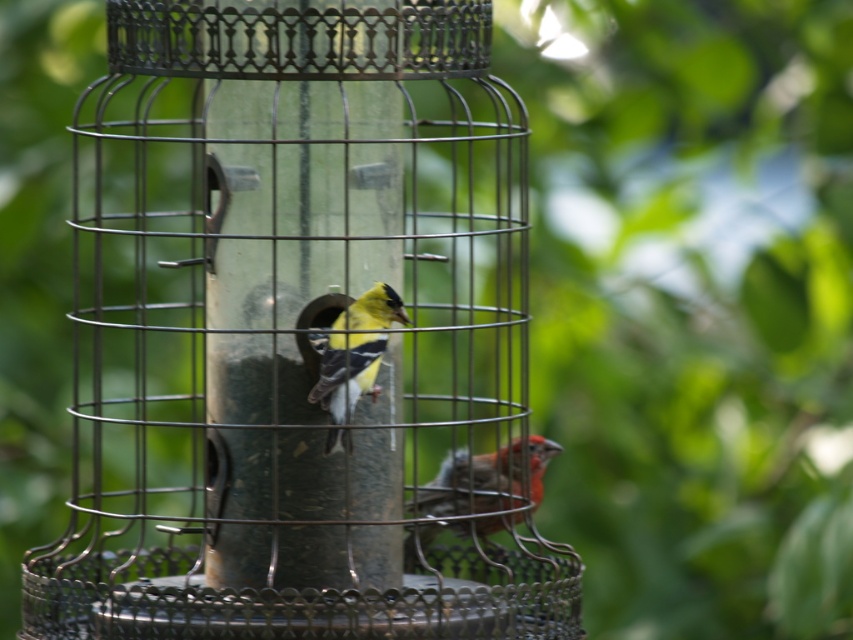
Question: Which of the following is the farthest from the observer?

Choices:
 (A) (381, 339)
 (B) (508, 472)

Answer: (B)

Question: Is metallic wire bird feeder at center thinner than yellow matte bird at center?

Choices:
 (A) yes
 (B) no

Answer: (B)

Question: Which of the following is the farthest from the observer?

Choices:
 (A) coord(349,208)
 (B) coord(496,500)

Answer: (B)

Question: Which of the following is the closest to the observer?

Choices:
 (A) metallic wire bird feeder at center
 (B) yellow matte bird at center

Answer: (A)

Question: Does metallic wire bird feeder at center appear on the right side of matte red bird at lower right?

Choices:
 (A) no
 (B) yes

Answer: (A)

Question: Is metallic wire bird feeder at center thinner than matte red bird at lower right?

Choices:
 (A) no
 (B) yes

Answer: (A)